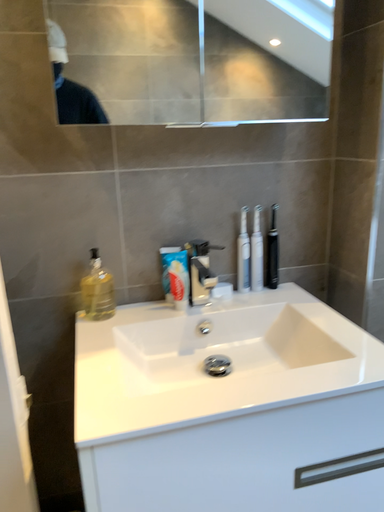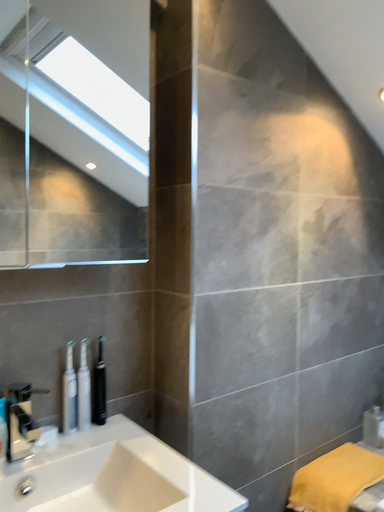
Question: How did the camera likely rotate when shooting the video?

Choices:
 (A) rotated right
 (B) rotated left

Answer: (A)